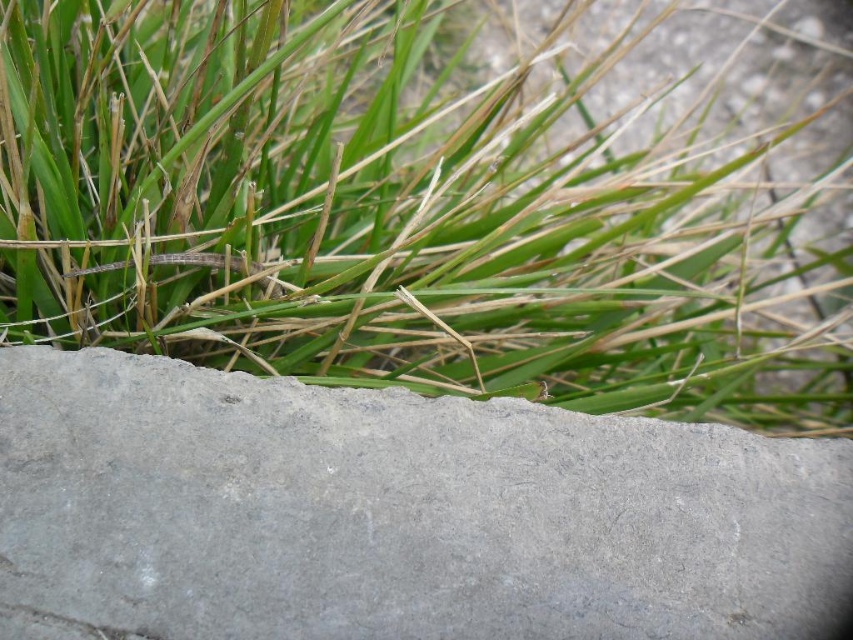
Question: Can you confirm if green grass at upper center is thinner than gray concrete at bottom?

Choices:
 (A) yes
 (B) no

Answer: (B)

Question: Among these points, which one is nearest to the camera?

Choices:
 (A) (494, 564)
 (B) (329, 358)

Answer: (A)

Question: Which object is farther from the camera taking this photo?

Choices:
 (A) gray concrete at bottom
 (B) green grass at upper center

Answer: (B)

Question: Considering the relative positions of green grass at upper center and gray concrete at bottom in the image provided, where is green grass at upper center located with respect to gray concrete at bottom?

Choices:
 (A) above
 (B) below

Answer: (A)

Question: Can you confirm if green grass at upper center is positioned below gray concrete at bottom?

Choices:
 (A) no
 (B) yes

Answer: (A)